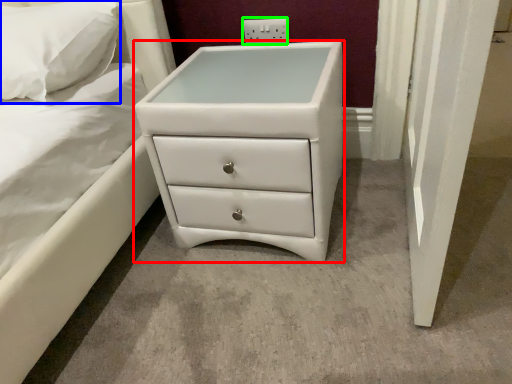
Question: Considering the real-world distances, which object is closest to chest of drawers (highlighted by a red box)? pillow (highlighted by a blue box) or electric outlet (highlighted by a green box).

Choices:
 (A) pillow
 (B) electric outlet

Answer: (A)